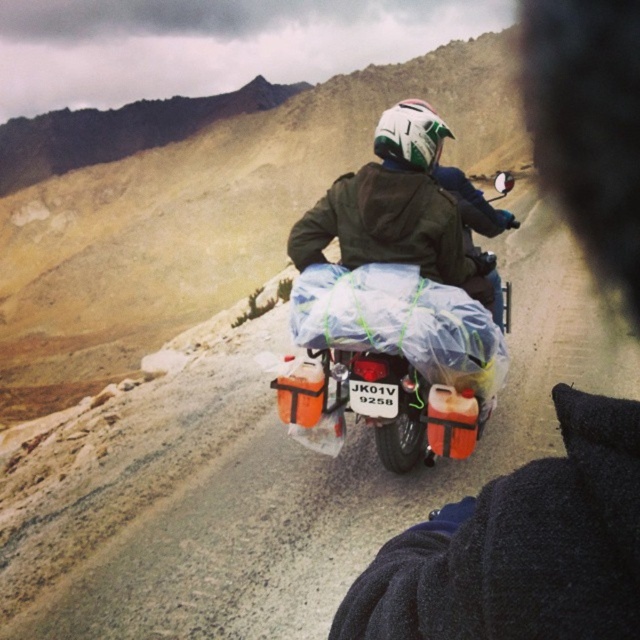
Does matte black jacket at center appear on the left side of matte orange plastic motorcycle at center?

In fact, matte black jacket at center is to the right of matte orange plastic motorcycle at center.

Which of these two, matte black jacket at center or matte orange plastic motorcycle at center, stands taller?

matte black jacket at center is taller.

At what (x,y) coordinates should I click in order to perform the action: click on matte black jacket at center. Please return your answer as a coordinate pair (x, y). Looking at the image, I should click on (520, 547).

This screenshot has width=640, height=640. What are the coordinates of `matte black jacket at center` in the screenshot? It's located at (520, 547).